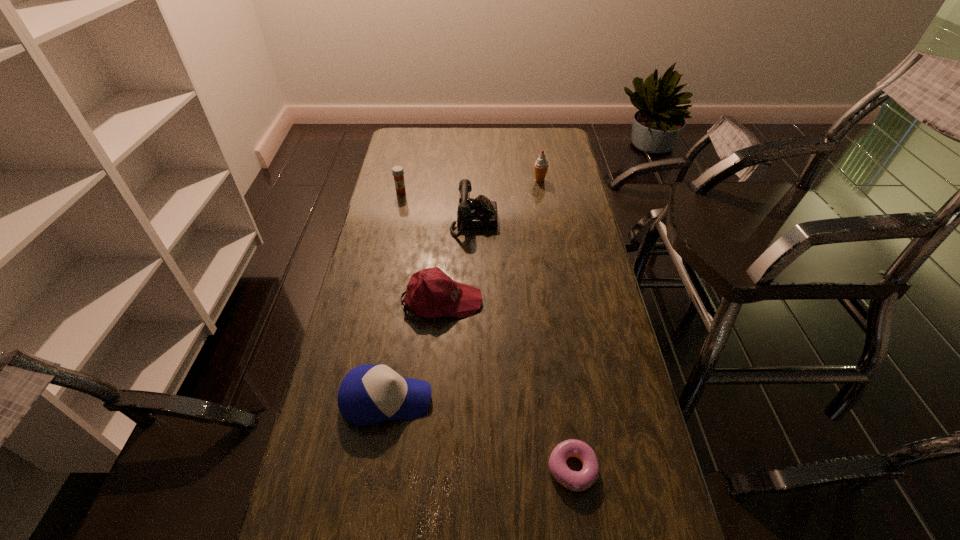
Find the location of `the farthest object`. the farthest object is located at coordinates (541, 165).

At what (x,y) coordinates should I click in order to perform the action: click on the third farthest object. Please return your answer as a coordinate pair (x, y). This screenshot has width=960, height=540. Looking at the image, I should click on (480, 213).

Identify the location of the third nearest object. The height and width of the screenshot is (540, 960). (430, 293).

The height and width of the screenshot is (540, 960). Find the location of `the fifth nearest object`. the fifth nearest object is located at coordinates (397, 171).

Locate an element on the screen. This screenshot has width=960, height=540. the fifth farthest object is located at coordinates (368, 394).

I want to click on doughnut, so click(x=577, y=481).

You are a GUI agent. You are given a task and a screenshot of the screen. Output one action in this format:
    pyautogui.click(x=<x>, y=<y>)
    Task: Click on the shortest object
    This screenshot has height=540, width=960.
    Given the screenshot: What is the action you would take?
    pyautogui.click(x=577, y=481)

Image resolution: width=960 pixels, height=540 pixels. Find the location of `vacant space situated on the front of the icecream`. vacant space situated on the front of the icecream is located at coordinates (548, 230).

Find the location of a particular element. The image size is (960, 540). vacant space located on the dial of the telephone is located at coordinates click(545, 221).

You are a GUI agent. You are given a task and a screenshot of the screen. Output one action in this format:
    pyautogui.click(x=<x>, y=<y>)
    Task: Click on the blank area located 0.210m at the front of the farther baseball cap with the brim
    
    Given the screenshot: What is the action you would take?
    pyautogui.click(x=549, y=300)